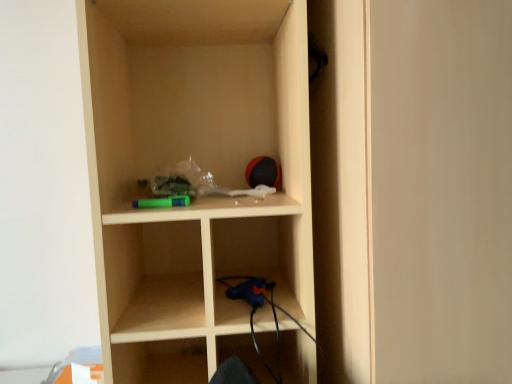
Question: Does matte wood shelf at center have a larger size compared to matte wood door at center?

Choices:
 (A) yes
 (B) no

Answer: (B)

Question: Does matte wood shelf at center turn towards matte wood door at center?

Choices:
 (A) yes
 (B) no

Answer: (B)

Question: Considering the relative positions of matte wood shelf at center and matte wood door at center in the image provided, is matte wood shelf at center behind matte wood door at center?

Choices:
 (A) no
 (B) yes

Answer: (B)

Question: Is matte wood shelf at center smaller than matte wood door at center?

Choices:
 (A) yes
 (B) no

Answer: (A)

Question: Are matte wood shelf at center and matte wood door at center located far from each other?

Choices:
 (A) no
 (B) yes

Answer: (A)

Question: From a real-world perspective, is matte wood shelf at center under matte wood door at center?

Choices:
 (A) yes
 (B) no

Answer: (B)

Question: Is matte wood door at center outside of matte wood shelf at center?

Choices:
 (A) yes
 (B) no

Answer: (A)

Question: Considering the relative sizes of matte wood door at center and matte wood shelf at center in the image provided, is matte wood door at center thinner than matte wood shelf at center?

Choices:
 (A) yes
 (B) no

Answer: (B)

Question: Is matte wood door at center positioned in front of matte wood shelf at center?

Choices:
 (A) no
 (B) yes

Answer: (B)

Question: Can you confirm if matte wood door at center is bigger than matte wood shelf at center?

Choices:
 (A) yes
 (B) no

Answer: (A)

Question: From the image's perspective, does matte wood door at center appear lower than matte wood shelf at center?

Choices:
 (A) yes
 (B) no

Answer: (A)

Question: From a real-world perspective, is matte wood door at center located beneath matte wood shelf at center?

Choices:
 (A) no
 (B) yes

Answer: (B)

Question: In the image, is matte wood door at center positioned in front of or behind matte wood shelf at center?

Choices:
 (A) behind
 (B) front

Answer: (B)